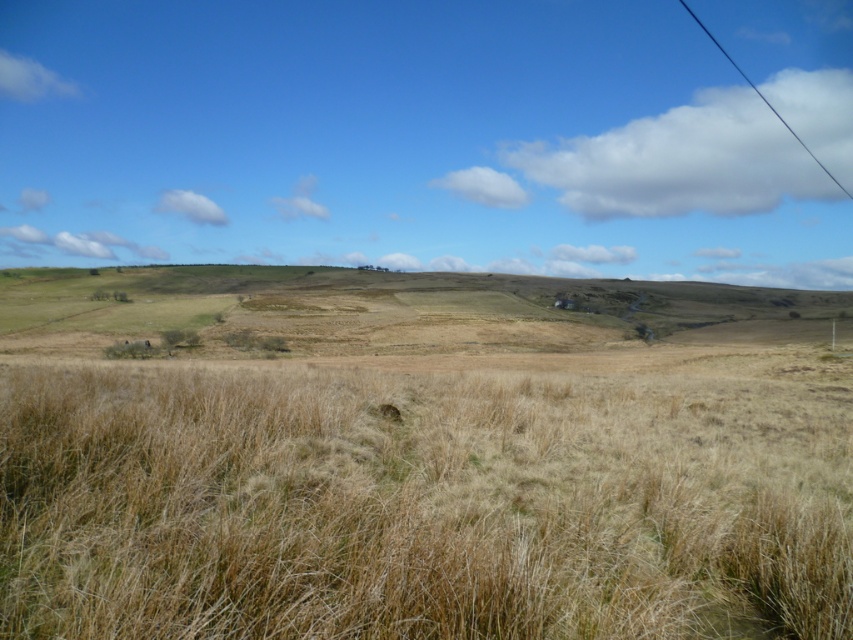
You are a farmer planning to plant new crops in the field. You notice two areas labeled as dry grass at center and dry grassland at center. Which area is farther from the other?

The dry grass at center and dry grassland at center are 114.70 meters apart from each other, so they are both at a distance of 114.70 meters from each other.

You are a farmer checking the field. You notice the dry grass at center and the black wire at upper right. Which object is wider?

The dry grass at center has a lesser width compared to the black wire at upper right, so the black wire at upper right is wider.

You are a farmer checking the field conditions. You notice two areas labeled as dry grass at center and dry grassland at center. Which area has a wider spread of dry vegetation?

The dry grassland at center has a wider spread of dry vegetation compared to the dry grass at center.